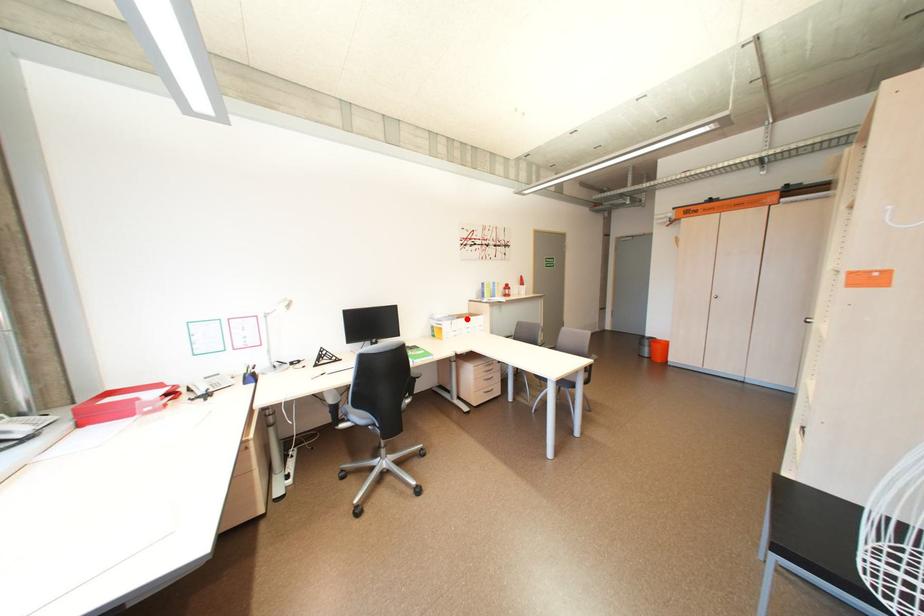
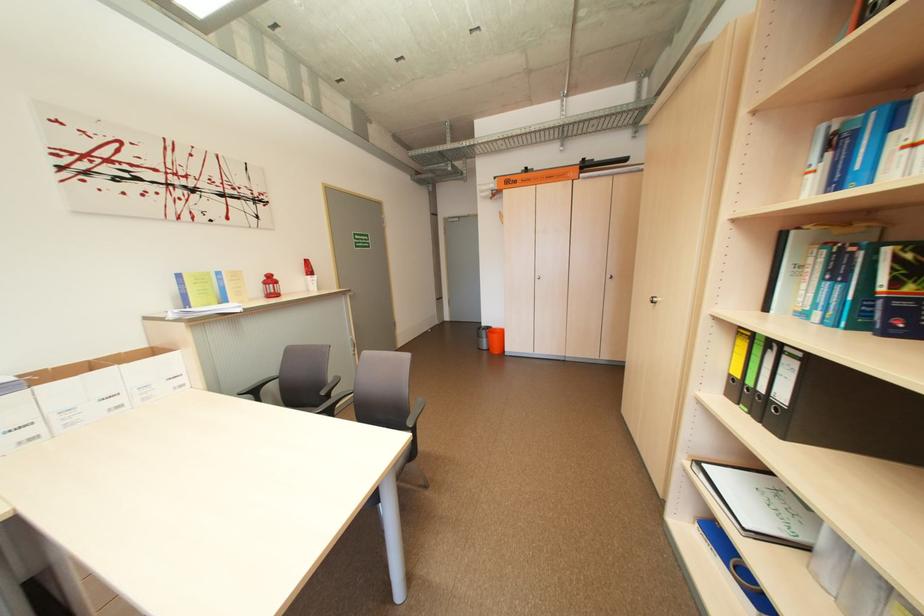
Find the pixel in the second image that matches the highlighted location in the first image.

(43, 384)